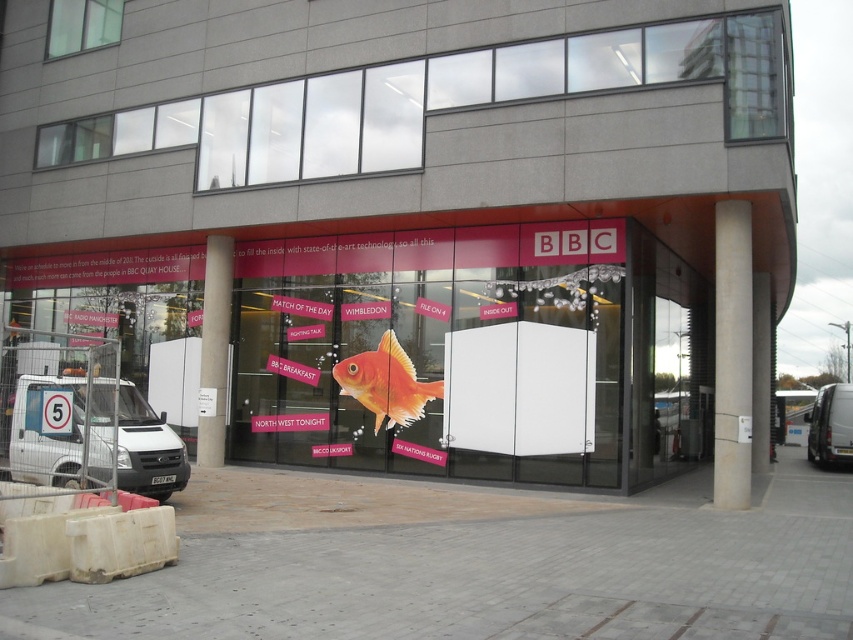
Question: Is white matte van at left bigger than matte orange fish at center?

Choices:
 (A) yes
 (B) no

Answer: (A)

Question: Does matte orange fish at center appear on the left side of white van at right?

Choices:
 (A) yes
 (B) no

Answer: (A)

Question: Which point appears closest to the camera in this image?

Choices:
 (A) (196, 451)
 (B) (846, 387)
 (C) (746, 268)
 (D) (358, 374)

Answer: (C)

Question: Does matte glass fish at center come behind white concrete pillar at center?

Choices:
 (A) no
 (B) yes

Answer: (A)

Question: Considering the real-world distances, which object is closest to the white concrete pillar at center?

Choices:
 (A) white van at right
 (B) matte glass fish at center
 (C) matte orange fish at center

Answer: (C)

Question: Which point is closer to the camera?

Choices:
 (A) matte glass fish at center
 (B) white smooth pillar at center

Answer: (A)